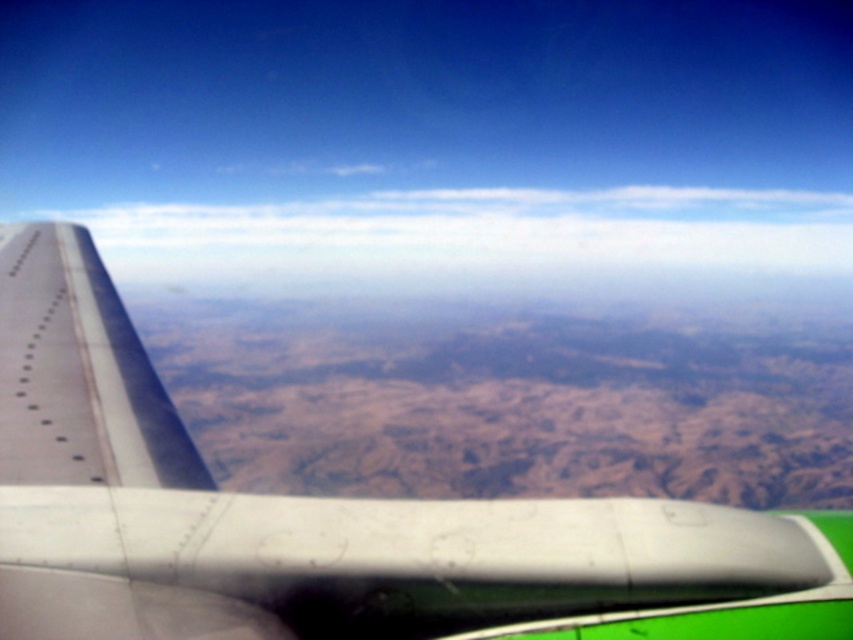
Is metallic gray wing at left to the left of white fluffy cloud at upper center from the viewer's perspective?

Yes, metallic gray wing at left is to the left of white fluffy cloud at upper center.

Who is positioned more to the left, metallic gray wing at left or white fluffy cloud at upper center?

metallic gray wing at left

Is point (172, 576) farther from viewer compared to point (514, 291)?

No.

Locate an element on the screen. metallic gray wing at left is located at coordinates (328, 518).